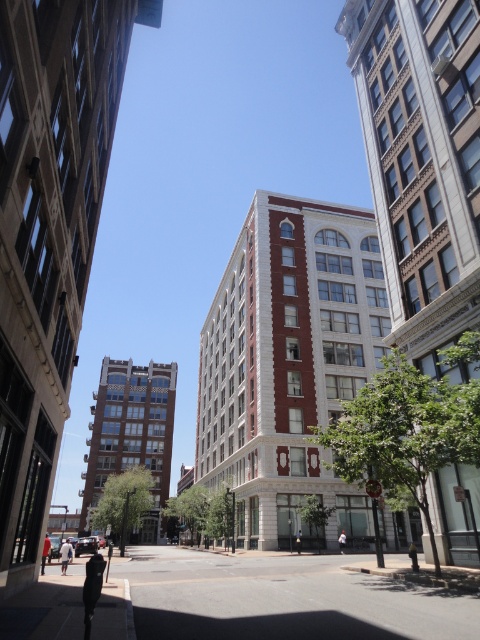
Question: Which point is farther to the camera?

Choices:
 (A) dark blue jeans at lower left
 (B) white cotton shirt at center

Answer: (B)

Question: Is metallic gold statue at center wider than black fabric person at center?

Choices:
 (A) no
 (B) yes

Answer: (B)

Question: Estimate the real-world distances between objects in this image. Which object is farther from the metallic gold statue at center?

Choices:
 (A) white cotton shirt at center
 (B) orange shirt at center
 (C) dark blue jeans at lower left
 (D) white cotton shirt at lower left

Answer: (D)

Question: Estimate the real-world distances between objects in this image. Which object is farther from the dark blue jeans at lower left?

Choices:
 (A) white cotton shirt at center
 (B) metallic gold statue at center
 (C) orange shirt at center

Answer: (A)

Question: Can you confirm if dark blue jeans at lower left is thinner than black fabric person at center?

Choices:
 (A) no
 (B) yes

Answer: (A)

Question: Can you confirm if orange shirt at center is thinner than white cotton shirt at center?

Choices:
 (A) no
 (B) yes

Answer: (A)